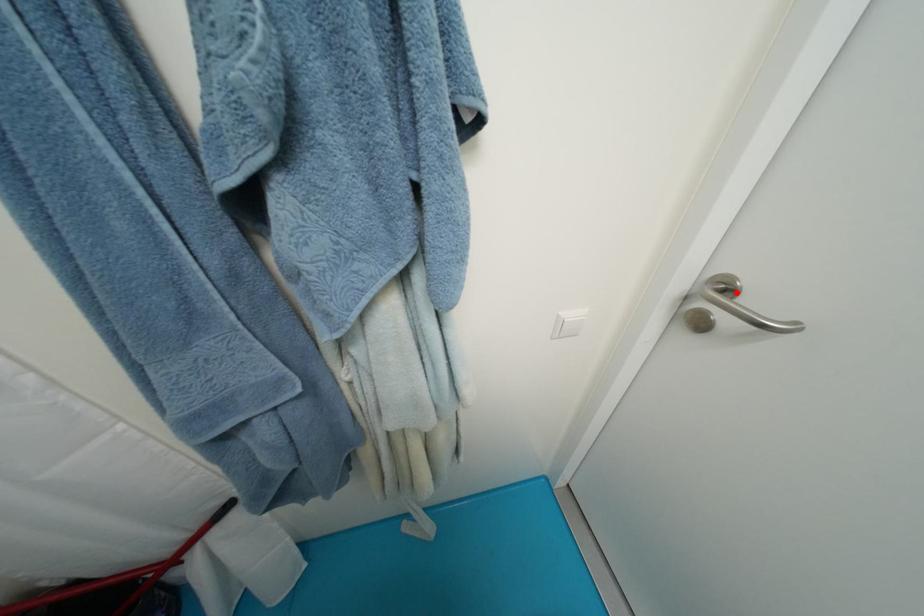
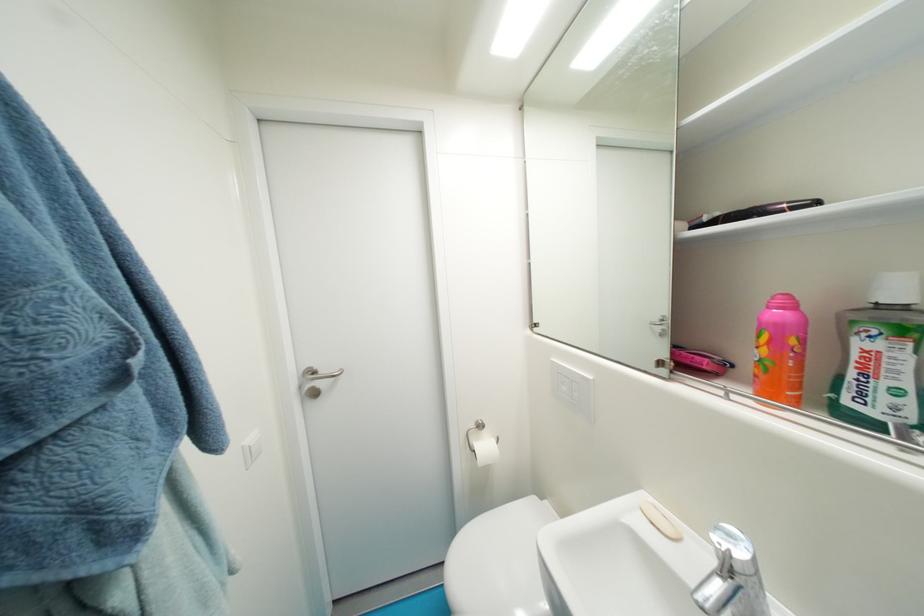
Find the pixel in the second image that matches the highlighted location in the first image.

(322, 374)